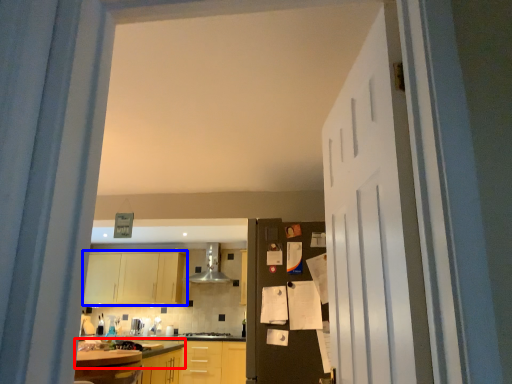
Question: Which object appears farthest to the camera in this image, countertop (highlighted by a red box) or cabinetry (highlighted by a blue box)?

Choices:
 (A) countertop
 (B) cabinetry

Answer: (B)